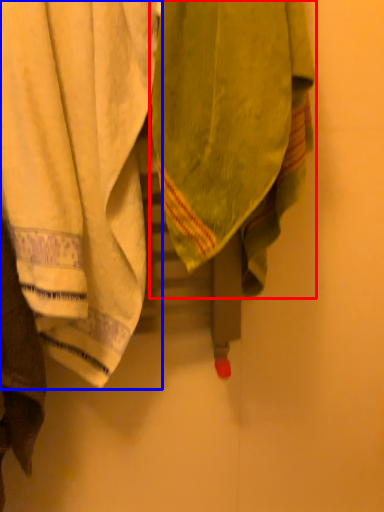
Question: Which of the following is the farthest to the observer, towel (highlighted by a red box) or towel (highlighted by a blue box)?

Choices:
 (A) towel
 (B) towel

Answer: (B)